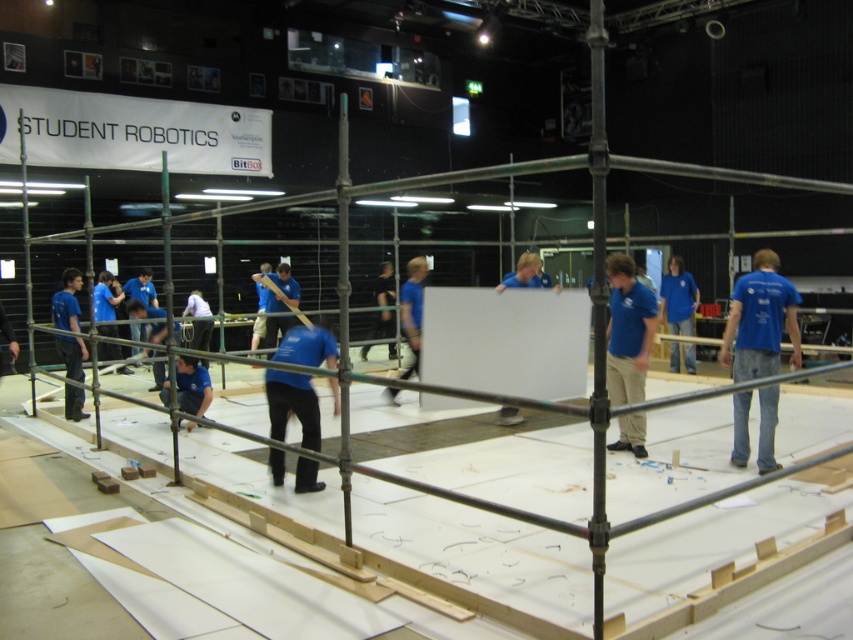
You are a fashion designer observing the scene. You need to determine which of the two shirts, the blue cotton shirt at center or the matte blue shirt at lower left, is more suitable for a lightweight summer collection. Which one would you choose and why?

The blue cotton shirt at center is thinner than the matte blue shirt at lower left, making it more suitable for a lightweight summer collection due to its thinner material.

You are a safety inspector in the workshop and need to ensure that all workers are within a 5 meter safety radius of each other for communication. Are the blue cotton shirt at center and the matte blue shirt at lower left within the required distance?

The blue cotton shirt at center and the matte blue shirt at lower left are 5.48 meters apart, which exceeds the 5 meter safety radius requirement. Therefore, they are not within the required distance for communication.

You are an observer in the scene and want to determine which team member is closer to you based on their clothing. Which of the two individuals wearing blue shirts, the matte blue shirt at lower left or the blue shirt at center, appears to be larger in size?

The matte blue shirt at lower left is larger in size than the blue shirt at center, so the matte blue shirt at lower left appears closer to you.